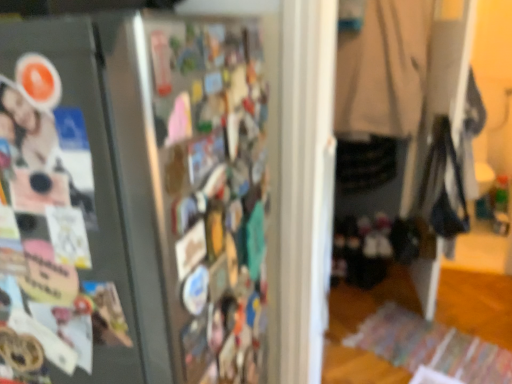
Question: Considering the relative positions of matte photo at left and beige fabric coat at center in the image provided, is matte photo at left to the right of beige fabric coat at center from the viewer's perspective?

Choices:
 (A) yes
 (B) no

Answer: (B)

Question: Considering the relative sizes of matte photo at left and beige fabric coat at center in the image provided, is matte photo at left bigger than beige fabric coat at center?

Choices:
 (A) no
 (B) yes

Answer: (A)

Question: Is matte photo at left positioned before beige fabric coat at center?

Choices:
 (A) no
 (B) yes

Answer: (B)

Question: Does matte photo at left have a greater height compared to beige fabric coat at center?

Choices:
 (A) yes
 (B) no

Answer: (B)

Question: Considering the relative sizes of matte photo at left and beige fabric coat at center in the image provided, is matte photo at left shorter than beige fabric coat at center?

Choices:
 (A) no
 (B) yes

Answer: (B)

Question: Relative to beige fabric coat at center, is matte photo at left in front or behind?

Choices:
 (A) behind
 (B) front

Answer: (B)

Question: From a real-world perspective, is matte photo at left positioned above or below beige fabric coat at center?

Choices:
 (A) below
 (B) above

Answer: (B)

Question: Looking at the image, does matte photo at left seem bigger or smaller compared to beige fabric coat at center?

Choices:
 (A) small
 (B) big

Answer: (A)

Question: Is matte photo at left to the left or to the right of beige fabric coat at center in the image?

Choices:
 (A) right
 (B) left

Answer: (B)

Question: Based on their sizes in the image, would you say beige fabric coat at center is bigger or smaller than matte photo at left?

Choices:
 (A) big
 (B) small

Answer: (A)

Question: Is beige fabric coat at center inside the boundaries of matte photo at left, or outside?

Choices:
 (A) outside
 (B) inside

Answer: (A)

Question: Considering their positions, is beige fabric coat at center located in front of or behind matte photo at left?

Choices:
 (A) behind
 (B) front

Answer: (A)

Question: Visually, is beige fabric coat at center positioned to the left or to the right of matte photo at left?

Choices:
 (A) left
 (B) right

Answer: (B)

Question: From the image's perspective, is satin black fridge at left located above or below beige fabric coat at center?

Choices:
 (A) below
 (B) above

Answer: (A)

Question: Is satin black fridge at left in front of or behind beige fabric coat at center in the image?

Choices:
 (A) front
 (B) behind

Answer: (A)